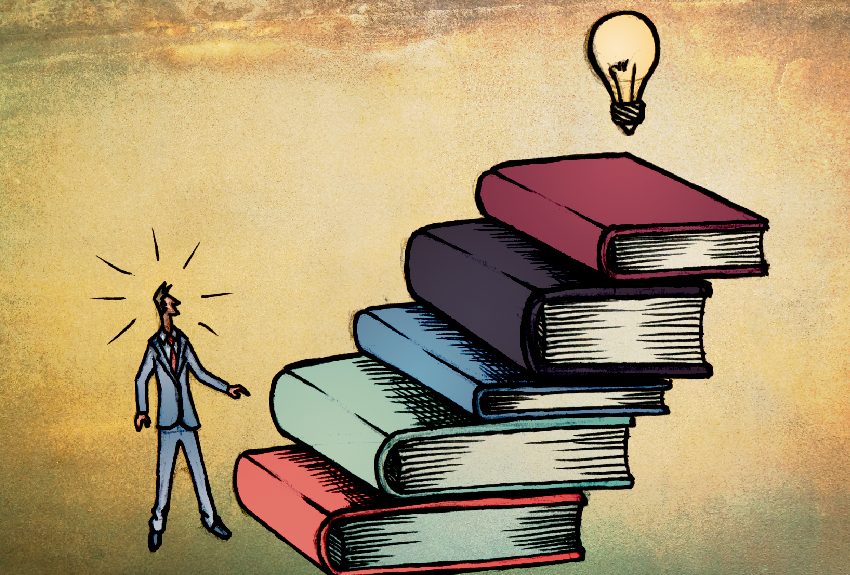
Find the location of `books stacked, presenting as a staircase leading to a lightbulb`. books stacked, presenting as a staircase leading to a lightbulb is located at coordinates (375, 525), (479, 460), (553, 405), (627, 345), (683, 233).